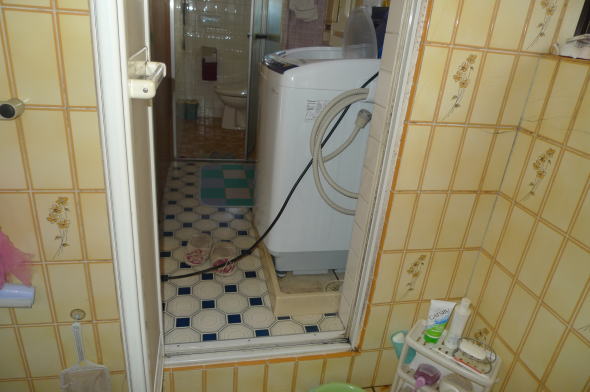
The width and height of the screenshot is (590, 392). Identify the location of door handle. (158, 82).